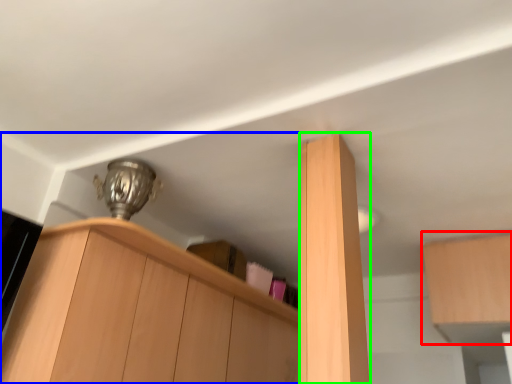
Question: Which object is positioned farthest from cabinetry (highlighted by a red box)? Select from cabinetry (highlighted by a blue box) and cabinetry (highlighted by a green box).

Choices:
 (A) cabinetry
 (B) cabinetry

Answer: (A)